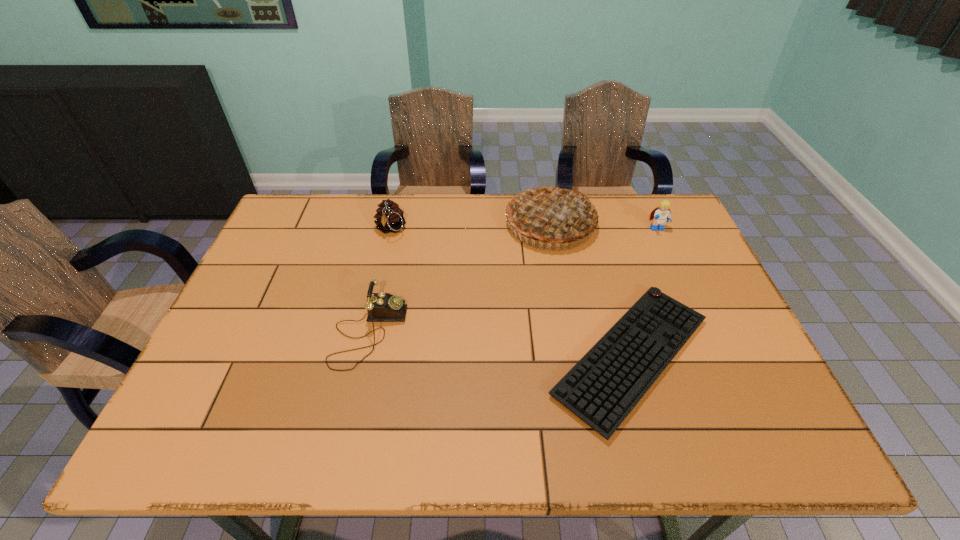
Locate an element on the screen. The width and height of the screenshot is (960, 540). free space that satisfies the following two spatial constraints: 1. with a leaf charm attached to the pinecone; 2. on the right side of the computer keyboard is located at coordinates (362, 356).

Identify the location of free space in the image that satisfies the following two spatial constraints: 1. on the dial of the computer keyboard; 2. on the right side of the telephone. (364, 356).

Find the location of `free space in the image that satisfies the following two spatial constraints: 1. on the front side of the computer keyboard; 2. on the right side of the tallest object`. free space in the image that satisfies the following two spatial constraints: 1. on the front side of the computer keyboard; 2. on the right side of the tallest object is located at coordinates click(x=574, y=356).